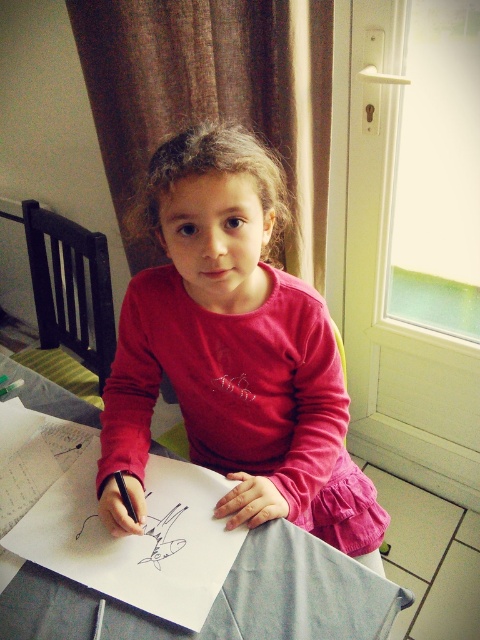
What is located at the point with coordinates (279, 596) in the image?

The point at coordinates (279, 596) indicates the location of the white paper at center.

Based on the photo, you are a photographer trying to capture the girl drawing. You notice a point at coordinates (x=233, y=353) on the image. Based on the scene description, can you determine what object this point is located on?

The point at coordinates (x=233, y=353) is on the pink fabric shirt at center.

You are an art teacher observing the girl drawing. You need to place a new drawing tool between the white paper at center and the black matte pencil at lower left. Based on their positions, where should you place the new tool so it doesn not block the girl s view of her paper?

The white paper at center is in front of the black matte pencil at lower left, so placing the new tool behind the white paper at center but in front of the black matte pencil at lower left would keep it from blocking the girl s view.